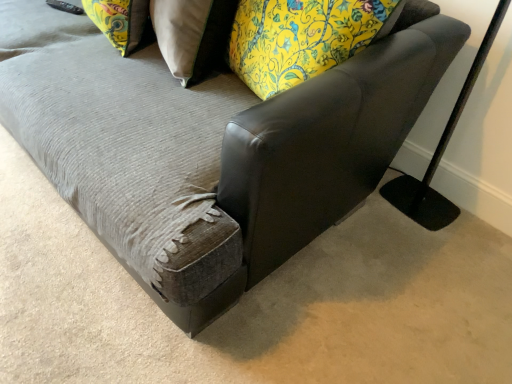
Measure the distance between leather swivel chair at center and camera.

30.47 inches.

This screenshot has width=512, height=384. Describe the element at coordinates (440, 152) in the screenshot. I see `black matte table lamp at right` at that location.

Identify the location of leather swivel chair at center. This screenshot has height=384, width=512. click(330, 138).

Is floral fabric pillow at upper center, placed as the 2th pillow when sorted from left to right, inside black matte table lamp at right?

→ No, floral fabric pillow at upper center, placed as the 2th pillow when sorted from left to right, is not inside black matte table lamp at right.

Measure the distance between black matte table lamp at right and floral fabric pillow at upper center, the 1th pillow when ordered from right to left.

33.42 inches.

In the image, is black matte table lamp at right on the left side or the right side of floral fabric pillow at upper center, the 1th pillow when ordered from right to left?

black matte table lamp at right is to the right of floral fabric pillow at upper center, the 1th pillow when ordered from right to left.

From the image's perspective, is black matte table lamp at right on top of floral fabric pillow at upper center, placed as the 2th pillow when sorted from left to right?

Incorrect, from the image's perspective, black matte table lamp at right is lower than floral fabric pillow at upper center, placed as the 2th pillow when sorted from left to right.

How much distance is there between leather swivel chair at center and floral fabric pillow at upper left, the second pillow viewed from the right?

A distance of 87.00 centimeters exists between leather swivel chair at center and floral fabric pillow at upper left, the second pillow viewed from the right.

Is leather swivel chair at center completely or partially outside of floral fabric pillow at upper left, which is the 1th pillow from left to right?

Yes, leather swivel chair at center is located beyond the bounds of floral fabric pillow at upper left, which is the 1th pillow from left to right.

Does leather swivel chair at center lie in front of floral fabric pillow at upper left, which is the 1th pillow from left to right?

Yes, leather swivel chair at center is closer to the camera.

Does leather swivel chair at center turn towards floral fabric pillow at upper left, the second pillow viewed from the right?

No.

Identify the location of pillow located in front of the floral fabric pillow at upper left, the second pillow viewed from the right. Image resolution: width=512 pixels, height=384 pixels. (192, 35).

Based on their sizes in the image, would you say floral fabric pillow at upper left, the second pillow viewed from the right, is bigger or smaller than floral fabric pillow at upper center, the 1th pillow when ordered from right to left?

Clearly, floral fabric pillow at upper left, the second pillow viewed from the right, is smaller in size than floral fabric pillow at upper center, the 1th pillow when ordered from right to left.

From a real-world perspective, who is located lower, floral fabric pillow at upper left, the second pillow viewed from the right, or floral fabric pillow at upper center, placed as the 2th pillow when sorted from left to right?

floral fabric pillow at upper center, placed as the 2th pillow when sorted from left to right.

From the image's perspective, which one is positioned lower, floral fabric pillow at upper center, the 1th pillow when ordered from right to left, or leather swivel chair at center?

leather swivel chair at center appears lower in the image.

Is floral fabric pillow at upper center, placed as the 2th pillow when sorted from left to right, turned away from leather swivel chair at center?

Yes, floral fabric pillow at upper center, placed as the 2th pillow when sorted from left to right,'s orientation is away from leather swivel chair at center.

From a real-world perspective, which is physically below, floral fabric pillow at upper center, the 1th pillow when ordered from right to left, or leather swivel chair at center?

floral fabric pillow at upper center, the 1th pillow when ordered from right to left, is physically lower.

Which object is closer to the camera, floral fabric pillow at upper center, the 1th pillow when ordered from right to left, or leather swivel chair at center?

leather swivel chair at center.

From a real-world perspective, is floral fabric pillow at upper left, which is the 1th pillow from left to right, positioned over black matte table lamp at right based on gravity?

Yes, from a real-world perspective, floral fabric pillow at upper left, which is the 1th pillow from left to right, is on top of black matte table lamp at right.

Considering the points (131, 21) and (453, 127), which point is in front, point (131, 21) or point (453, 127)?

The point (131, 21) is more forward.

Is floral fabric pillow at upper left, which is the 1th pillow from left to right, turned away from black matte table lamp at right?

No, floral fabric pillow at upper left, which is the 1th pillow from left to right,'s orientation is not away from black matte table lamp at right.

Considering their positions, is floral fabric pillow at upper left, the second pillow viewed from the right, located in front of or behind black matte table lamp at right?

Clearly, floral fabric pillow at upper left, the second pillow viewed from the right, is behind black matte table lamp at right.

This screenshot has width=512, height=384. In order to click on pillow lying on the left of floral fabric pillow at upper center, the 1th pillow when ordered from right to left in this screenshot , I will do `click(119, 21)`.

Considering the sizes of objects floral fabric pillow at upper center, the 1th pillow when ordered from right to left, and floral fabric pillow at upper left, which is the 1th pillow from left to right, in the image provided, who is wider, floral fabric pillow at upper center, the 1th pillow when ordered from right to left, or floral fabric pillow at upper left, which is the 1th pillow from left to right,?

Wider between the two is floral fabric pillow at upper center, the 1th pillow when ordered from right to left.

Can you confirm if floral fabric pillow at upper center, placed as the 2th pillow when sorted from left to right, is positioned to the right of black matte table lamp at right?

In fact, floral fabric pillow at upper center, placed as the 2th pillow when sorted from left to right, is to the left of black matte table lamp at right.

From the image's perspective, is floral fabric pillow at upper center, placed as the 2th pillow when sorted from left to right, above black matte table lamp at right?

Yes, from the image's perspective, floral fabric pillow at upper center, placed as the 2th pillow when sorted from left to right, is over black matte table lamp at right.

Which of these two, floral fabric pillow at upper center, the 1th pillow when ordered from right to left, or black matte table lamp at right, is bigger?

With larger size is floral fabric pillow at upper center, the 1th pillow when ordered from right to left.

Which is closer to the camera, (163, 22) or (409, 206)?

Positioned in front is point (163, 22).

Where is `table lamp below the floral fabric pillow at upper center, the 1th pillow when ordered from right to left (from a real-world perspective)`? The height and width of the screenshot is (384, 512). table lamp below the floral fabric pillow at upper center, the 1th pillow when ordered from right to left (from a real-world perspective) is located at coordinates (440, 152).

The image size is (512, 384). Identify the location of swivel chair below the floral fabric pillow at upper left, the second pillow viewed from the right (from the image's perspective). (330, 138).

Estimate the real-world distances between objects in this image. Which object is further from floral fabric pillow at upper left, which is the 1th pillow from left to right, black matte table lamp at right or floral fabric pillow at upper center, the 1th pillow when ordered from right to left?

The object further to floral fabric pillow at upper left, which is the 1th pillow from left to right, is black matte table lamp at right.

Looking at the image, which one is located closer to floral fabric pillow at upper center, placed as the 2th pillow when sorted from left to right, leather swivel chair at center or floral fabric pillow at upper left, which is the 1th pillow from left to right?

floral fabric pillow at upper left, which is the 1th pillow from left to right, is closer to floral fabric pillow at upper center, placed as the 2th pillow when sorted from left to right.

Which object lies further to the anchor point leather swivel chair at center, floral fabric pillow at upper left, which is the 1th pillow from left to right, or floral fabric pillow at upper center, the 1th pillow when ordered from right to left?

Among the two, floral fabric pillow at upper left, which is the 1th pillow from left to right, is located further to leather swivel chair at center.

Considering their positions, is floral fabric pillow at upper center, placed as the 2th pillow when sorted from left to right, positioned closer to black matte table lamp at right than floral fabric pillow at upper left, the second pillow viewed from the right?

floral fabric pillow at upper center, placed as the 2th pillow when sorted from left to right, is positioned closer to the anchor black matte table lamp at right.

From the image, which object appears to be nearer to leather swivel chair at center, floral fabric pillow at upper center, placed as the 2th pillow when sorted from left to right, or floral fabric pillow at upper left, which is the 1th pillow from left to right?

floral fabric pillow at upper center, placed as the 2th pillow when sorted from left to right, is closer to leather swivel chair at center.

Based on their spatial positions, is leather swivel chair at center or floral fabric pillow at upper center, the 1th pillow when ordered from right to left, closer to floral fabric pillow at upper left, which is the 1th pillow from left to right?

Based on the image, floral fabric pillow at upper center, the 1th pillow when ordered from right to left, appears to be nearer to floral fabric pillow at upper left, which is the 1th pillow from left to right.

From the image, which object appears to be nearer to leather swivel chair at center, floral fabric pillow at upper left, the second pillow viewed from the right, or black matte table lamp at right?

black matte table lamp at right is closer to leather swivel chair at center.

Based on their spatial positions, is floral fabric pillow at upper center, the 1th pillow when ordered from right to left, or black matte table lamp at right further from floral fabric pillow at upper left, which is the 1th pillow from left to right?

black matte table lamp at right is positioned further to the anchor floral fabric pillow at upper left, which is the 1th pillow from left to right.

I want to click on swivel chair between floral fabric pillow at upper center, the 1th pillow when ordered from right to left, and black matte table lamp at right, so click(330, 138).

The image size is (512, 384). What are the coordinates of `pillow situated between floral fabric pillow at upper left, the second pillow viewed from the right, and black matte table lamp at right from left to right` in the screenshot? It's located at (192, 35).

Identify the location of swivel chair between floral fabric pillow at upper left, the second pillow viewed from the right, and black matte table lamp at right. (330, 138).

At what (x,y) coordinates should I click in order to perform the action: click on pillow situated between floral fabric pillow at upper left, the second pillow viewed from the right, and leather swivel chair at center from left to right. Please return your answer as a coordinate pair (x, y). This screenshot has width=512, height=384. Looking at the image, I should click on (192, 35).